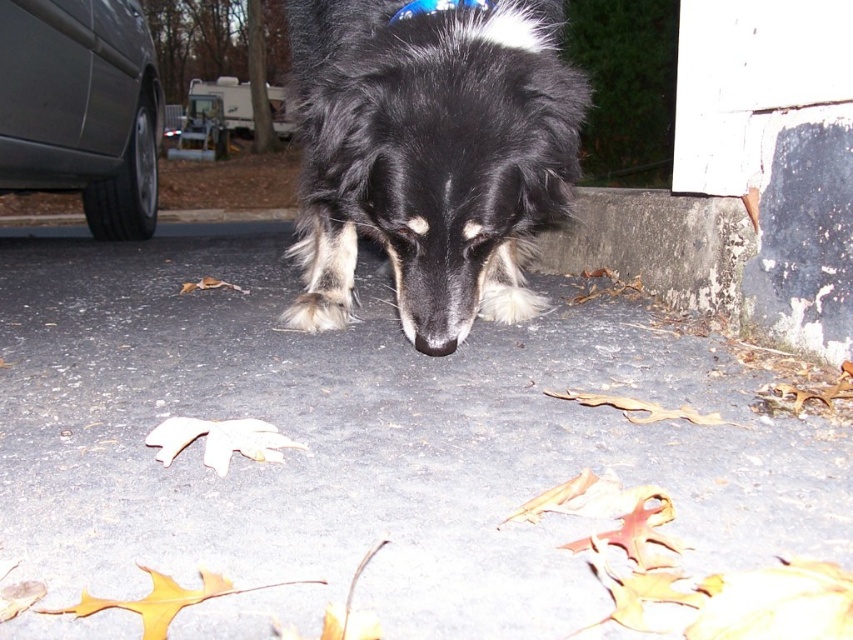
Question: Estimate the real-world distances between objects in this image. Which object is closer to the blue fabric neckband at upper center?

Choices:
 (A) metallic gray van at left
 (B) black fluffy dog at center
 (C) gray asphalt pavement at center

Answer: (B)

Question: Which object is positioned farthest from the black fluffy dog at center?

Choices:
 (A) metallic gray van at left
 (B) blue fabric neckband at upper center
 (C) gray asphalt pavement at center

Answer: (A)

Question: Can you confirm if gray asphalt pavement at center is positioned below blue fabric neckband at upper center?

Choices:
 (A) yes
 (B) no

Answer: (A)

Question: Is gray asphalt pavement at center wider than metallic gray van at left?

Choices:
 (A) no
 (B) yes

Answer: (B)

Question: Which object is farther from the camera taking this photo?

Choices:
 (A) black fluffy dog at center
 (B) gray asphalt pavement at center

Answer: (A)

Question: Does black fluffy dog at center have a larger size compared to metallic gray van at left?

Choices:
 (A) no
 (B) yes

Answer: (A)